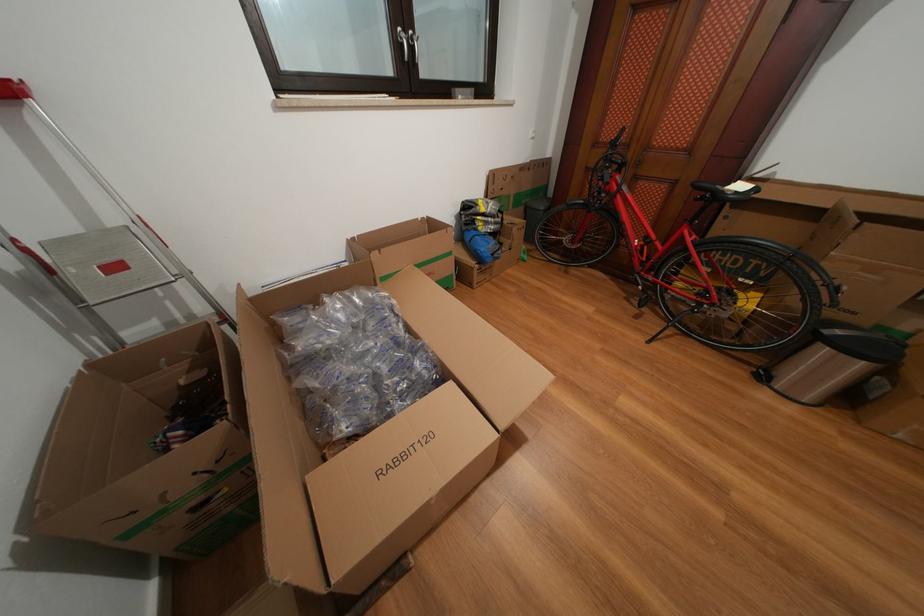
Identify the location of black trash can lid. [x=860, y=345].